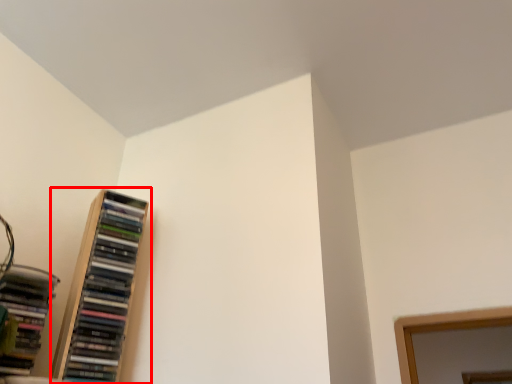
Question: Observing the image, what is the correct spatial positioning of bookcase (annotated by the red box) in reference to book?

Choices:
 (A) right
 (B) left

Answer: (A)